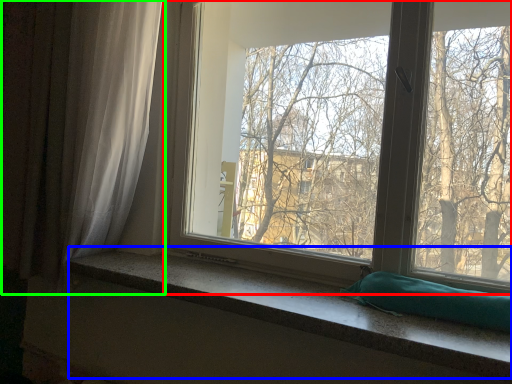
Question: Which object is positioned closest to window (highlighted by a red box)? Select from window sill (highlighted by a blue box) and curtain (highlighted by a green box).

Choices:
 (A) window sill
 (B) curtain

Answer: (B)